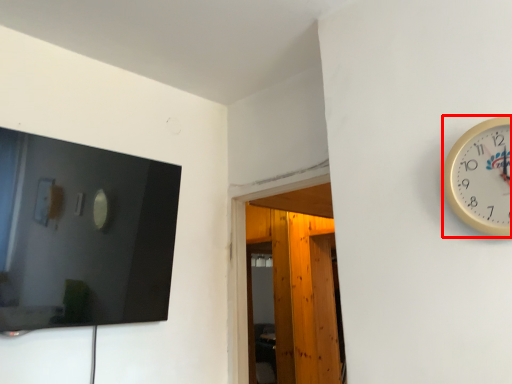
Question: From the image, what is the correct spatial relationship of wall clock (annotated by the red box) in relation to glass door?

Choices:
 (A) left
 (B) right

Answer: (B)